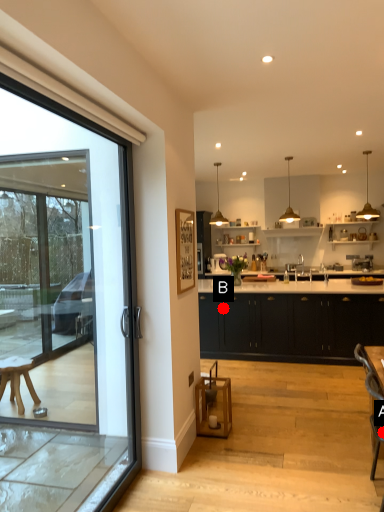
Question: Two points are circled on the image, labeled by A and B beside each circle. Which point appears closest to the camera in this image?

Choices:
 (A) A is closer
 (B) B is closer

Answer: (A)